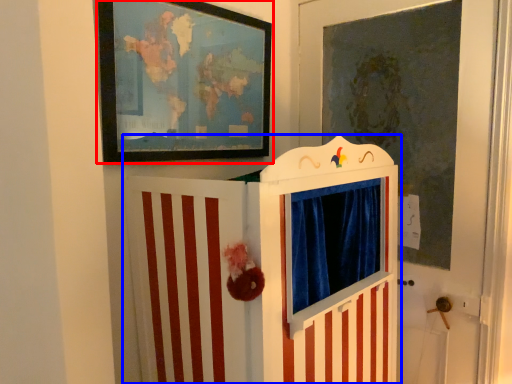
Question: Among these objects, which one is nearest to the camera, picture frame (highlighted by a red box) or furniture (highlighted by a blue box)?

Choices:
 (A) picture frame
 (B) furniture

Answer: (B)